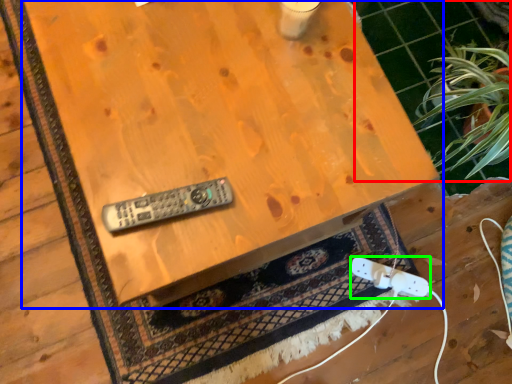
Question: Estimate the real-world distances between objects in this image. Which object is closer to tile (highlighted by a red box), table (highlighted by a blue box) or game controller (highlighted by a green box)?

Choices:
 (A) table
 (B) game controller

Answer: (B)